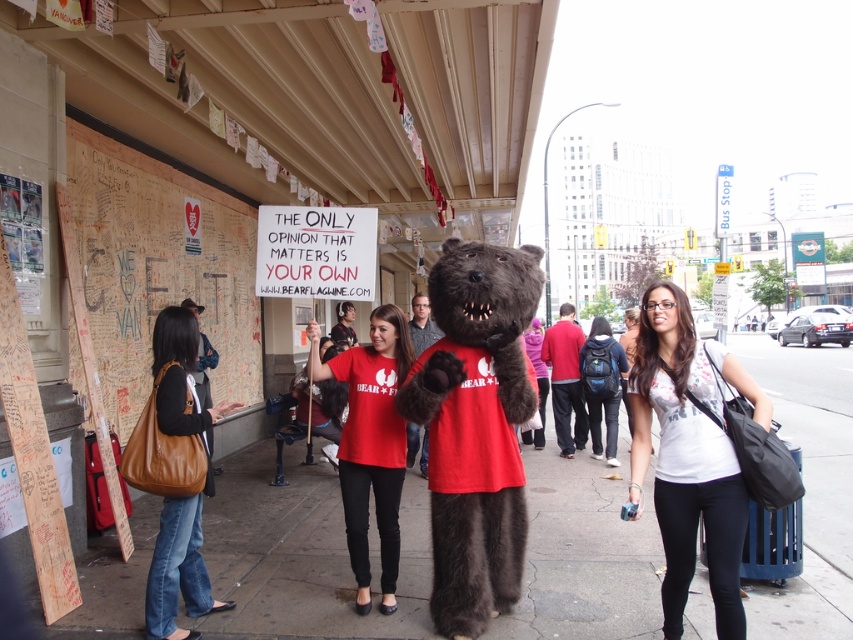
Question: Can you confirm if fuzzy brown bear at center is positioned to the right of brown leather purse at lower left?

Choices:
 (A) no
 (B) yes

Answer: (B)

Question: Can you confirm if fuzzy brown bear at center is positioned to the right of brown leather purse at lower left?

Choices:
 (A) yes
 (B) no

Answer: (A)

Question: Which point is farther to the camera?

Choices:
 (A) (456, 470)
 (B) (115, 209)
 (C) (675, 380)

Answer: (B)

Question: Is concrete sidewalk at center in front of wooden wall at left?

Choices:
 (A) no
 (B) yes

Answer: (B)

Question: Which object is positioned farthest from the fuzzy brown bear at center?

Choices:
 (A) white matte tank top at center
 (B) wooden wall at left
 (C) matte red t-shirt at center
 (D) concrete sidewalk at center

Answer: (B)

Question: Which is nearer to the brown leather purse at lower left?

Choices:
 (A) concrete sidewalk at center
 (B) matte red t-shirt at center
 (C) wooden wall at left
 (D) fuzzy brown bear at center

Answer: (B)